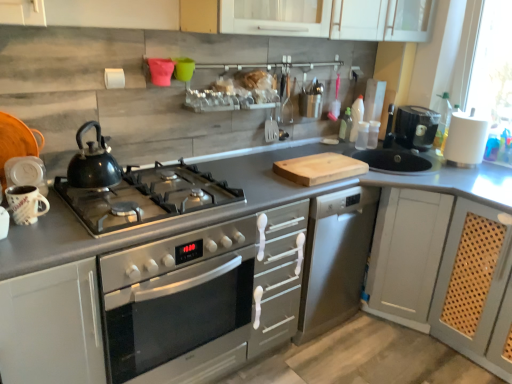
Locate an element on the screen. free space above white matte cabinet at lower left, which is the 1th cabinetry from left to right (from a real-world perspective) is located at coordinates (36, 237).